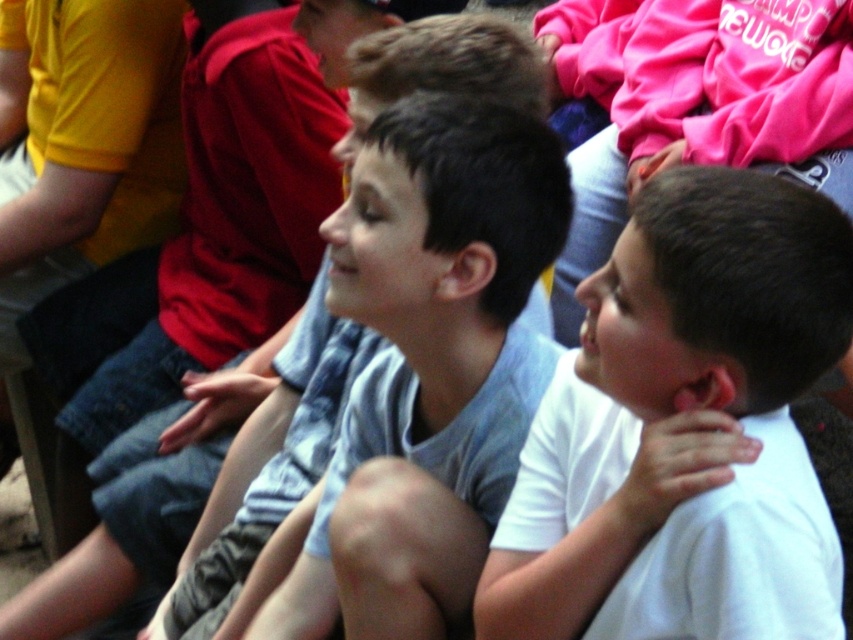
Based on the scene description, which child is wearing the white matte shirt at center positioned to the right of the gray cotton shirt at center?

The white matte shirt at center is to the right of the gray cotton shirt at center, so the child wearing the white matte shirt at center is positioned to the right of the one in the gray cotton shirt at center.

You are a tailor who needs to determine which shirt requires more fabric for alterations. Based on the image, which shirt between the white matte shirt at center and the gray cotton shirt at center would need more fabric due to its larger size?

The gray cotton shirt at center requires more fabric for alterations because it has a greater width than the white matte shirt at center.